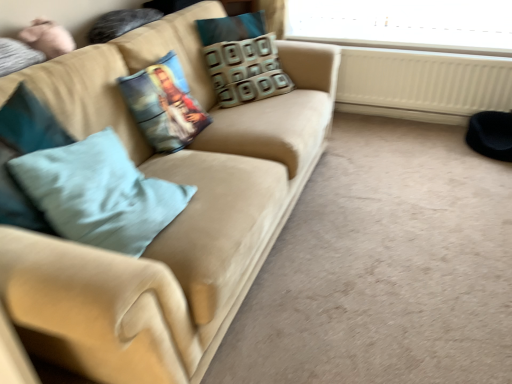
Question: Considering the relative sizes of light blue fabric pillow at left and patterned fabric pillow at center, the 1th pillow from the right, in the image provided, is light blue fabric pillow at left bigger than patterned fabric pillow at center, the 1th pillow from the right,?

Choices:
 (A) no
 (B) yes

Answer: (B)

Question: Is light blue fabric pillow at left smaller than patterned fabric pillow at center, the 1th pillow from the right?

Choices:
 (A) no
 (B) yes

Answer: (A)

Question: Is light blue fabric pillow at left looking in the opposite direction of patterned fabric pillow at center, marked as the 2th pillow in a front-to-back arrangement?

Choices:
 (A) yes
 (B) no

Answer: (B)

Question: Is the depth of light blue fabric pillow at left less than that of patterned fabric pillow at center, which is counted as the 1th pillow, starting from the back?

Choices:
 (A) no
 (B) yes

Answer: (B)

Question: Does light blue fabric pillow at left appear on the left side of patterned fabric pillow at center, the 1th pillow from the right?

Choices:
 (A) no
 (B) yes

Answer: (B)

Question: In the image, is printed fabric pillow at center, which appears as the second pillow when viewed from the right, on the left side or the right side of white plastic radiator at lower right?

Choices:
 (A) left
 (B) right

Answer: (A)

Question: In terms of height, does printed fabric pillow at center, marked as the 1th pillow in a front-to-back arrangement, look taller or shorter compared to white plastic radiator at lower right?

Choices:
 (A) tall
 (B) short

Answer: (B)

Question: In the image, is printed fabric pillow at center, placed as the 1th pillow when sorted from left to right, positioned in front of or behind white plastic radiator at lower right?

Choices:
 (A) front
 (B) behind

Answer: (A)

Question: Based on their sizes in the image, would you say printed fabric pillow at center, the second pillow in the back-to-front sequence, is bigger or smaller than white plastic radiator at lower right?

Choices:
 (A) big
 (B) small

Answer: (B)

Question: From a real-world perspective, is light blue fabric pillow at left physically located above or below suede beige couch at center?

Choices:
 (A) below
 (B) above

Answer: (B)

Question: Is light blue fabric pillow at left inside or outside of suede beige couch at center?

Choices:
 (A) inside
 (B) outside

Answer: (A)

Question: Looking at the image, does light blue fabric pillow at left seem bigger or smaller compared to suede beige couch at center?

Choices:
 (A) big
 (B) small

Answer: (B)

Question: Relative to suede beige couch at center, is light blue fabric pillow at left in front or behind?

Choices:
 (A) behind
 (B) front

Answer: (A)

Question: Would you say suede beige couch at center is inside or outside light blue fabric pillow at left?

Choices:
 (A) inside
 (B) outside

Answer: (B)

Question: Considering the positions of suede beige couch at center and light blue fabric pillow at left in the image, is suede beige couch at center wider or thinner than light blue fabric pillow at left?

Choices:
 (A) wide
 (B) thin

Answer: (A)